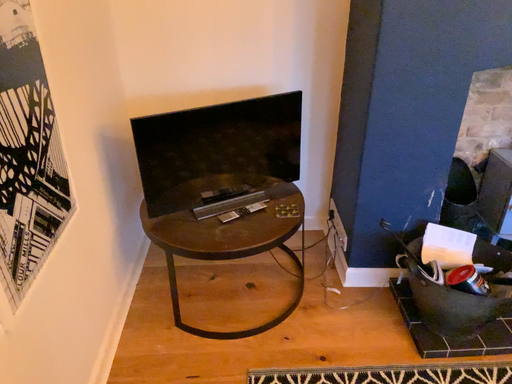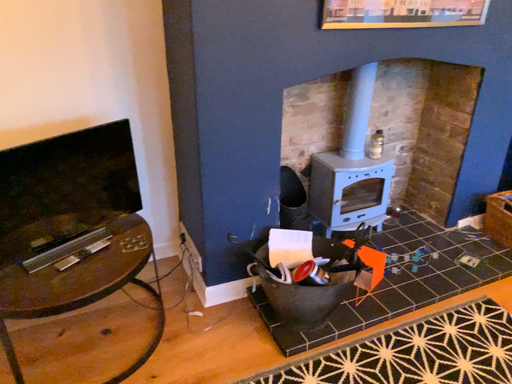
Question: How did the camera likely rotate when shooting the video?

Choices:
 (A) rotated right
 (B) rotated left

Answer: (A)